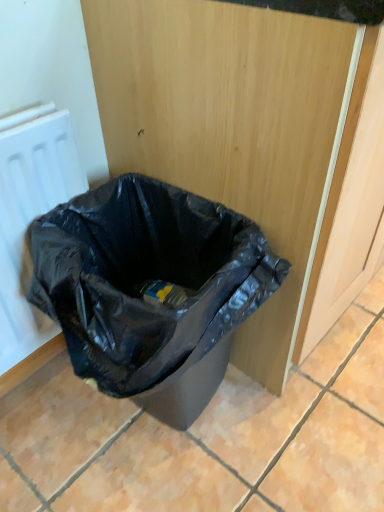
What do you see at coordinates (30, 214) in the screenshot?
I see `white matte radiator at left` at bounding box center [30, 214].

Locate an element on the screen. The width and height of the screenshot is (384, 512). white matte radiator at left is located at coordinates (30, 214).

At what (x,y) coordinates should I click in order to perform the action: click on black plastic bag at lower left. Please return your answer as a coordinate pair (x, y). The image size is (384, 512). Looking at the image, I should click on coord(147,286).

What do you see at coordinates (147, 286) in the screenshot? The height and width of the screenshot is (512, 384). I see `black plastic bag at lower left` at bounding box center [147, 286].

Find the location of a particular element. The width and height of the screenshot is (384, 512). white matte radiator at left is located at coordinates (30, 214).

Is black plastic bag at lower left to the left or to the right of white matte radiator at left in the image?

Clearly, black plastic bag at lower left is on the right of white matte radiator at left in the image.

Looking at this image, is black plastic bag at lower left behind white matte radiator at left?

No, it is not.

Is point (144, 242) behind point (21, 132)?

Yes, it is.

From the image's perspective, which one is positioned higher, black plastic bag at lower left or white matte radiator at left?

From the image's view, white matte radiator at left is above.

From a real-world perspective, who is located higher, black plastic bag at lower left or white matte radiator at left?

white matte radiator at left, from a real-world perspective.

Is black plastic bag at lower left wider than white matte radiator at left?

Yes, black plastic bag at lower left is wider than white matte radiator at left.

Considering the sizes of objects black plastic bag at lower left and white matte radiator at left in the image provided, who is taller, black plastic bag at lower left or white matte radiator at left?

white matte radiator at left.

Is black plastic bag at lower left bigger than white matte radiator at left?

Indeed, black plastic bag at lower left has a larger size compared to white matte radiator at left.

Is black plastic bag at lower left spatially inside white matte radiator at left, or outside of it?

black plastic bag at lower left is not enclosed by white matte radiator at left.

Would you say black plastic bag at lower left is a long distance from white matte radiator at left?

No.

Is white matte radiator at left at the back of black plastic bag at lower left?

Yes, white matte radiator at left is at the back of black plastic bag at lower left.

Looking at this image, how different are the orientations of black plastic bag at lower left and white matte radiator at left in degrees?

1.22 degrees separate the facing orientations of black plastic bag at lower left and white matte radiator at left.

At what (x,y) coordinates should I click in order to perform the action: click on waste container located underneath the white matte radiator at left (from a real-world perspective). Please return your answer as a coordinate pair (x, y). Looking at the image, I should click on (147, 286).

Considering the positions of objects white matte radiator at left and black plastic bag at lower left in the image provided, who is more to the left, white matte radiator at left or black plastic bag at lower left?

From the viewer's perspective, white matte radiator at left appears more on the left side.

Is white matte radiator at left further to camera compared to black plastic bag at lower left?

Yes, it is behind black plastic bag at lower left.

Between point (73, 186) and point (84, 216), which one is positioned behind?

The point (84, 216) is behind.

From the image's perspective, is white matte radiator at left under black plastic bag at lower left?

No, from the image's perspective, white matte radiator at left is not beneath black plastic bag at lower left.

From a real-world perspective, is white matte radiator at left physically below black plastic bag at lower left?

No.

Between white matte radiator at left and black plastic bag at lower left, which one has smaller width?

white matte radiator at left is thinner.

Considering the sizes of white matte radiator at left and black plastic bag at lower left in the image, is white matte radiator at left taller or shorter than black plastic bag at lower left?

Clearly, white matte radiator at left is taller compared to black plastic bag at lower left.

Considering the relative sizes of white matte radiator at left and black plastic bag at lower left in the image provided, is white matte radiator at left smaller than black plastic bag at lower left?

Indeed, white matte radiator at left has a smaller size compared to black plastic bag at lower left.

Is white matte radiator at left located outside black plastic bag at lower left?

Indeed, white matte radiator at left is completely outside black plastic bag at lower left.

Is white matte radiator at left positioned far away from black plastic bag at lower left?

white matte radiator at left is actually quite close to black plastic bag at lower left.

Is white matte radiator at left positioned with its back to black plastic bag at lower left?

No, black plastic bag at lower left is not at the back of white matte radiator at left.

Can you tell me how much white matte radiator at left and black plastic bag at lower left differ in facing direction?

1.22 degrees separate the facing orientations of white matte radiator at left and black plastic bag at lower left.

Find the location of a particular element. This screenshot has height=512, width=384. waste container on the right of white matte radiator at left is located at coordinates (147, 286).

This screenshot has height=512, width=384. In order to click on waste container to the right of white matte radiator at left in this screenshot , I will do `click(147, 286)`.

The image size is (384, 512). Identify the location of waste container below the white matte radiator at left (from the image's perspective). (147, 286).